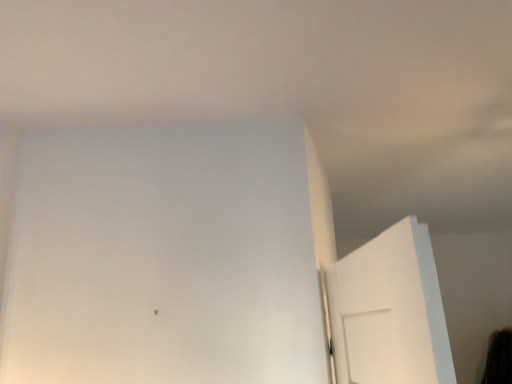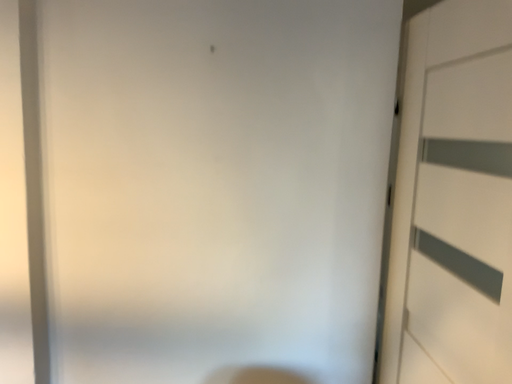
Question: How did the camera likely rotate when shooting the video?

Choices:
 (A) rotated upward
 (B) rotated downward

Answer: (B)